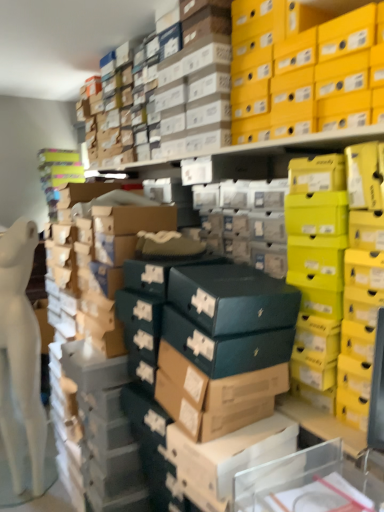
Question: Is yellow matte shoebox at upper right positioned in front of brown cardboard box at center?

Choices:
 (A) yes
 (B) no

Answer: (B)

Question: Considering the relative sizes of yellow matte shoebox at upper right and brown cardboard box at center in the image provided, is yellow matte shoebox at upper right thinner than brown cardboard box at center?

Choices:
 (A) no
 (B) yes

Answer: (B)

Question: Can you confirm if yellow matte shoebox at upper right is shorter than brown cardboard box at center?

Choices:
 (A) no
 (B) yes

Answer: (B)

Question: Are yellow matte shoebox at upper right and brown cardboard box at center far apart?

Choices:
 (A) no
 (B) yes

Answer: (B)

Question: From a real-world perspective, is yellow matte shoebox at upper right located higher than brown cardboard box at center?

Choices:
 (A) no
 (B) yes

Answer: (B)

Question: Can we say yellow matte shoebox at upper right lies outside brown cardboard box at center?

Choices:
 (A) yes
 (B) no

Answer: (A)

Question: Is brown cardboard box at center positioned behind yellow matte shoebox at upper right?

Choices:
 (A) yes
 (B) no

Answer: (B)

Question: Could yellow matte shoebox at upper right be considered to be inside brown cardboard box at center?

Choices:
 (A) yes
 (B) no

Answer: (B)

Question: From a real-world perspective, does brown cardboard box at center sit lower than yellow matte shoebox at upper right?

Choices:
 (A) no
 (B) yes

Answer: (B)

Question: Considering the relative sizes of brown cardboard box at center and yellow matte shoebox at upper right in the image provided, is brown cardboard box at center bigger than yellow matte shoebox at upper right?

Choices:
 (A) no
 (B) yes

Answer: (A)

Question: Does brown cardboard box at center have a smaller size compared to yellow matte shoebox at upper right?

Choices:
 (A) yes
 (B) no

Answer: (A)

Question: Is brown cardboard box at center shorter than yellow matte shoebox at upper right?

Choices:
 (A) yes
 (B) no

Answer: (B)

Question: In terms of height, does yellow matte shoebox at upper right look taller or shorter compared to brown cardboard box at center?

Choices:
 (A) tall
 (B) short

Answer: (B)